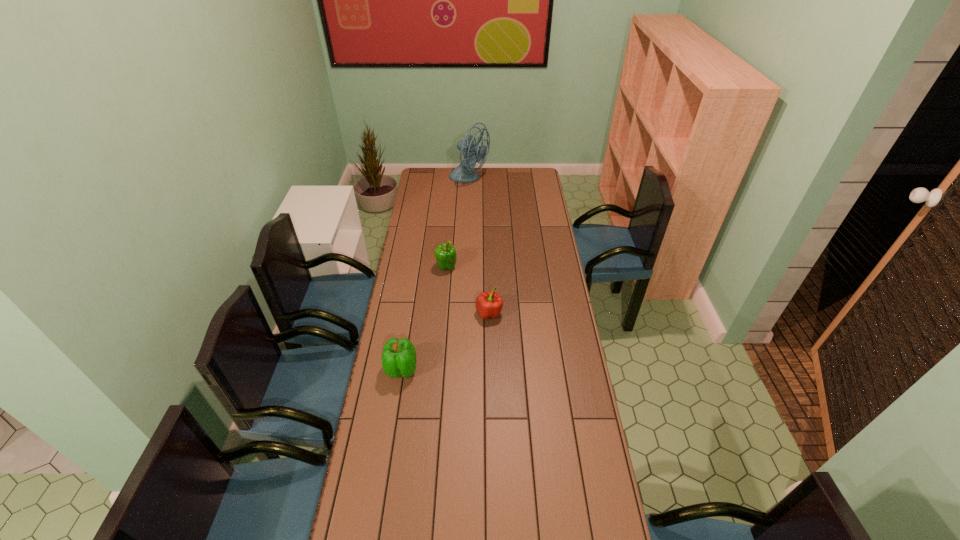
Where is `empty location between the second farthest object and the tallest object`? empty location between the second farthest object and the tallest object is located at coordinates (458, 223).

You are a GUI agent. You are given a task and a screenshot of the screen. Output one action in this format:
    pyautogui.click(x=<x>, y=<y>)
    Task: Click on the free space between the farthest object and the nearest bell pepper
    This screenshot has height=540, width=960.
    Given the screenshot: What is the action you would take?
    pyautogui.click(x=436, y=274)

I want to click on empty space that is in between the farthest bell pepper and the rightmost bell pepper, so click(468, 290).

This screenshot has height=540, width=960. In order to click on free space between the third nearest object and the fan in this screenshot , I will do `click(458, 223)`.

Identify the location of free space that is in between the leftmost object and the second nearest bell pepper. The width and height of the screenshot is (960, 540). (445, 341).

Image resolution: width=960 pixels, height=540 pixels. Find the location of `free spot between the tallest object and the farthest bell pepper`. free spot between the tallest object and the farthest bell pepper is located at coordinates (458, 223).

You are a GUI agent. You are given a task and a screenshot of the screen. Output one action in this format:
    pyautogui.click(x=<x>, y=<y>)
    Task: Click on the vacant space in between the rightmost bell pepper and the farthest object
    
    Given the screenshot: What is the action you would take?
    pyautogui.click(x=479, y=246)

You are a GUI agent. You are given a task and a screenshot of the screen. Output one action in this format:
    pyautogui.click(x=<x>, y=<y>)
    Task: Click on the object that can be found as the third closest to the leftmost object
    Image resolution: width=960 pixels, height=540 pixels.
    Given the screenshot: What is the action you would take?
    pyautogui.click(x=464, y=172)

You are a GUI agent. You are given a task and a screenshot of the screen. Output one action in this format:
    pyautogui.click(x=<x>, y=<y>)
    Task: Click on the object that is the nearest to the leftmost object
    The width and height of the screenshot is (960, 540).
    Given the screenshot: What is the action you would take?
    pyautogui.click(x=489, y=305)

Identify the location of bell pepper object that ranks as the third closest to the farthest object. The image size is (960, 540). coord(399,359).